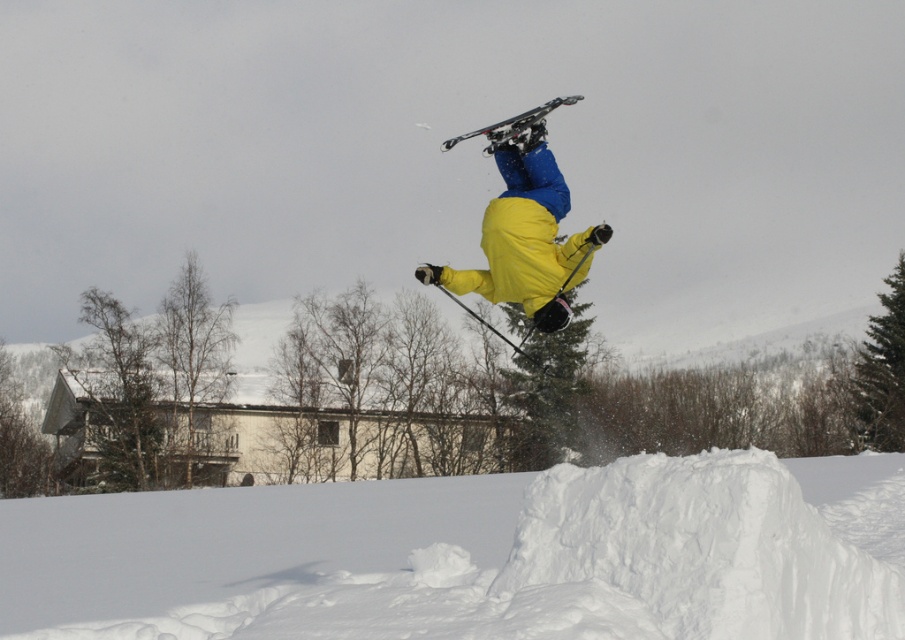
Question: In this image, where is white fluffy snow at center located relative to yellow matte snowboarder at center?

Choices:
 (A) left
 (B) right

Answer: (B)

Question: Is white fluffy snow at center above yellow matte snowboarder at center?

Choices:
 (A) yes
 (B) no

Answer: (B)

Question: Which point is farther to the camera?

Choices:
 (A) yellow matte snowboarder at center
 (B) white fluffy snow at center

Answer: (A)

Question: Does white fluffy snow at center appear on the left side of yellow matte snowboarder at center?

Choices:
 (A) yes
 (B) no

Answer: (B)

Question: Which of the following is the closest to the observer?

Choices:
 (A) yellow matte snowboarder at center
 (B) white fluffy snow at center

Answer: (B)